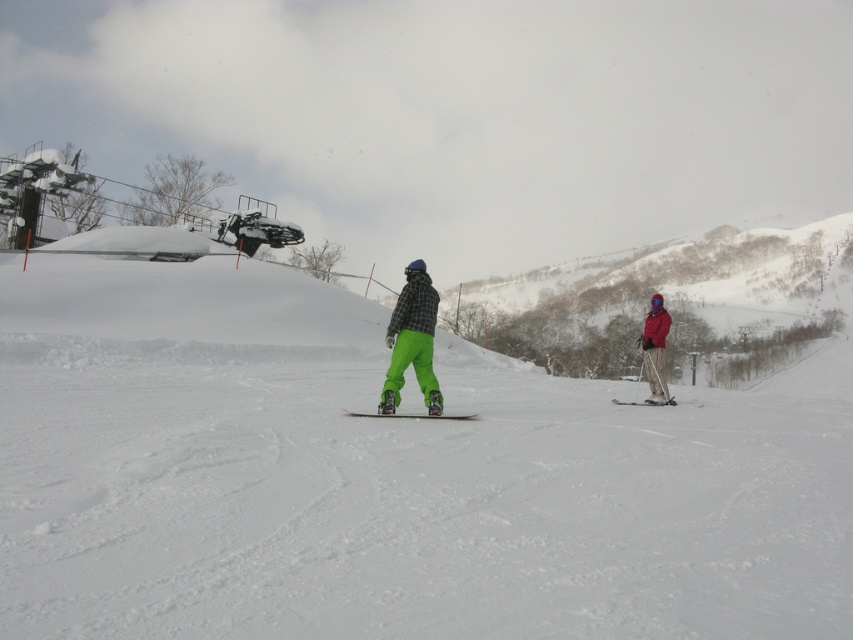
You are a photographer trying to capture the snowboarder and the skier in a single shot. Considering the white fluffy snow at center and the neon green snowboard at center, where should you position your camera to ensure both the snowboarder and the skier are visible?

Position the camera above the white fluffy snow at center so that the neon green snowboard at center is visible above it, allowing both the snowboarder and the skier to be in the frame.

You are a winter sports equipment inspector and need to determine if both the neon green snowboard at center and the matte black snowboard at center can fit side by side on a standard 1.5 meter wide equipment rack. Given their widths, can they fit?

The neon green snowboard at center is wider than the matte black snowboard at center. However, without knowing the exact widths of both snowboards, it is impossible to determine if their combined width exceeds 1.5 meters. Additional measurements are required.

You are a snowboarder who wants to choose a snowboard that is easier to maneuver. Based on the scene, which snowboard should you pick between the neon green snowboard at center and the matte black snowboard at center?

The matte black snowboard at center is smaller in size compared to the neon green snowboard at center, so it would be easier to maneuver.